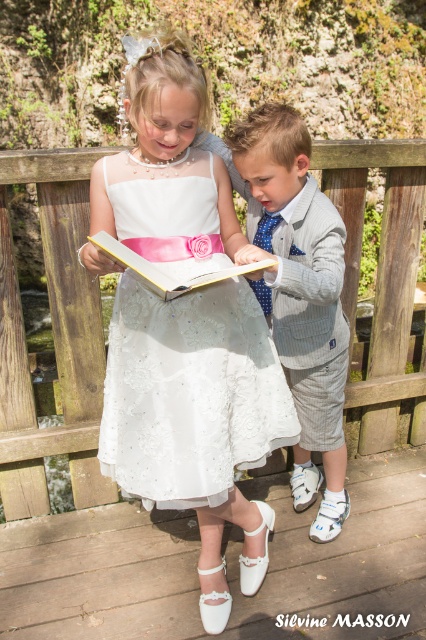
You are a photographer trying to capture a clear shot of the white lace dress at center and the hardcover book at center. Which object should you focus on first to ensure it appears sharp in your photo?

The white lace dress at center is closer to the viewer than the hardcover book at center, so you should focus on the white lace dress at center first to ensure it appears sharp.

You are a photographer trying to capture a closeup of the hardcover book at center while ensuring the light gray pinstripe suit at center is still visible in the frame. Given their sizes, which object should you focus on to ensure both are in the shot?

The light gray pinstripe suit at center is bigger than the hardcover book at center, so you should focus on the light gray pinstripe suit at center to ensure both are visible in the frame.